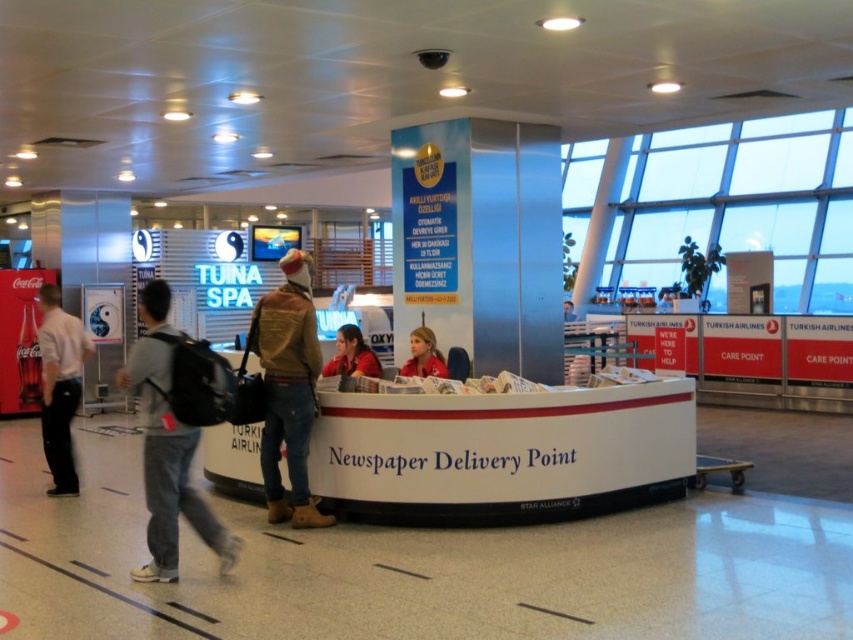
You are standing at the Newspaper Delivery Point counter in the airport terminal. There are two points marked on the floor in front of you. One is at coordinates point (294, 438) and the other is at point (49, 308). Which point is closer to your current position?

The point at coordinates point (294, 438) is closer to your current position at the Newspaper Delivery Point counter because it is closer to the camera, which represents your viewpoint.

You are standing in the airport terminal and see the brown leather jacket at center. If you were to walk directly towards it from your current position, which direction should you head?

The brown leather jacket at center is located at point coordinates of 0.609 on the x axis and 0.339 on the y axis, so you should walk towards the center of the scene to reach it.